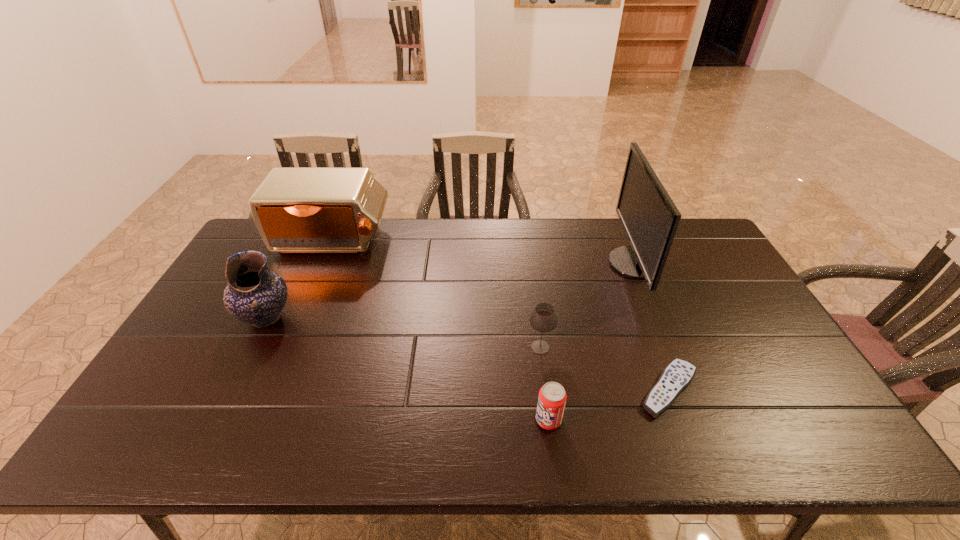
Locate an element on the screen. The image size is (960, 540). monitor is located at coordinates (649, 217).

Where is `toaster oven`? This screenshot has height=540, width=960. toaster oven is located at coordinates (296, 210).

The height and width of the screenshot is (540, 960). Find the location of `pottery`. pottery is located at coordinates (255, 295).

Where is `the third shortest object`? The height and width of the screenshot is (540, 960). the third shortest object is located at coordinates (543, 318).

Find the location of a particular element. This screenshot has height=540, width=960. the second shortest object is located at coordinates (552, 397).

Locate an element on the screen. remote control is located at coordinates (677, 376).

Identify the location of free space located on the screen side of the tallest object. (490, 264).

Where is `vacant point located on the screen side of the tallest object`? Image resolution: width=960 pixels, height=540 pixels. vacant point located on the screen side of the tallest object is located at coordinates (514, 264).

Identify the location of vacant space located 0.250m on the screen side of the tallest object. (535, 264).

Where is `vacant space located 0.300m on the door side of the toaster oven`? vacant space located 0.300m on the door side of the toaster oven is located at coordinates (295, 330).